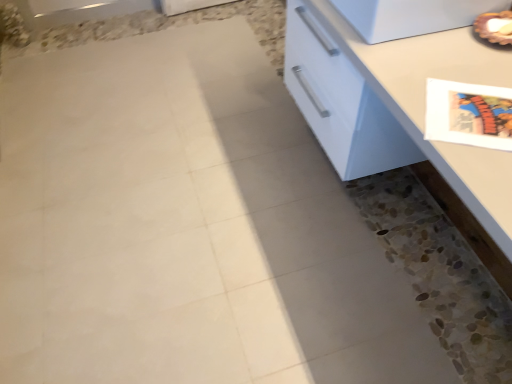
The height and width of the screenshot is (384, 512). Identify the location of vacant space underneath white glossy countertop at right (from a real-world perspective). (409, 271).